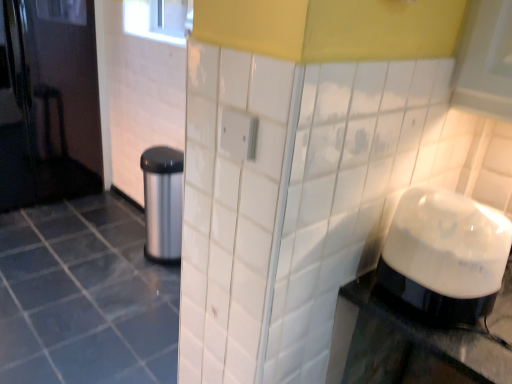
Question: Relative to white glossy tile at center, is white glossy blender at right in front or behind?

Choices:
 (A) behind
 (B) front

Answer: (B)

Question: Would you say white glossy blender at right is to the left or to the right of white glossy tile at center in the picture?

Choices:
 (A) right
 (B) left

Answer: (A)

Question: Estimate the real-world distances between objects in this image. Which object is closer to the white glossy blender at right?

Choices:
 (A) satin silver trash can at left
 (B) white glossy tile at center

Answer: (B)

Question: Which object is the farthest from the satin silver trash can at left?

Choices:
 (A) white glossy blender at right
 (B) white glossy tile at center

Answer: (A)